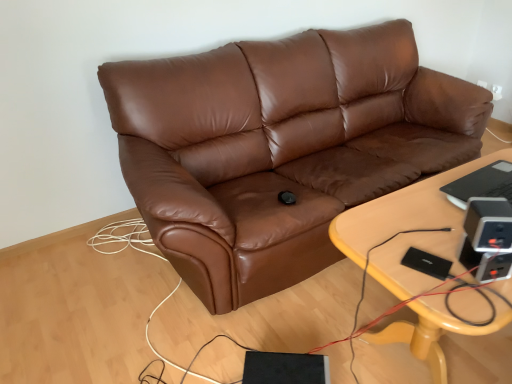
Describe the element at coordinates (407, 228) in the screenshot. I see `light wood/yellowishmaterial/texture table at center` at that location.

What are the coordinates of `light wood/yellowishmaterial/texture table at center` in the screenshot? It's located at (407, 228).

At what (x,y) coordinates should I click in order to perform the action: click on brown leather couch at center. Please return your answer as a coordinate pair (x, y). Looking at the image, I should click on (280, 148).

What do you see at coordinates (280, 148) in the screenshot?
I see `brown leather couch at center` at bounding box center [280, 148].

In order to click on light wood/yellowishmaterial/texture table at center in this screenshot , I will do `click(407, 228)`.

Considering the positions of objects brown leather couch at center and light wood/yellowishmaterial/texture table at center in the image provided, who is more to the right, brown leather couch at center or light wood/yellowishmaterial/texture table at center?

Positioned to the right is light wood/yellowishmaterial/texture table at center.

Considering their positions, is brown leather couch at center located in front of or behind light wood/yellowishmaterial/texture table at center?

brown leather couch at center is positioned farther from the viewer than light wood/yellowishmaterial/texture table at center.

Is point (477, 124) more distant than point (459, 224)?

That is True.

From the image's perspective, which is below, brown leather couch at center or light wood/yellowishmaterial/texture table at center?

light wood/yellowishmaterial/texture table at center appears lower in the image.

From a real-world perspective, is brown leather couch at center on light wood/yellowishmaterial/texture table at center?

Yes, from a real-world perspective, brown leather couch at center is over light wood/yellowishmaterial/texture table at center

Is brown leather couch at center wider than light wood/yellowishmaterial/texture table at center?

Indeed, brown leather couch at center has a greater width compared to light wood/yellowishmaterial/texture table at center.

Is brown leather couch at center taller than light wood/yellowishmaterial/texture table at center?

Yes, brown leather couch at center is taller than light wood/yellowishmaterial/texture table at center.

Does brown leather couch at center have a smaller size compared to light wood/yellowishmaterial/texture table at center?

Actually, brown leather couch at center might be larger than light wood/yellowishmaterial/texture table at center.

Does brown leather couch at center contain light wood/yellowishmaterial/texture table at center?

Definitely not — light wood/yellowishmaterial/texture table at center is not inside brown leather couch at center.

Is brown leather couch at center positioned far away from light wood/yellowishmaterial/texture table at center?

No.

Looking at this image, could you tell me if brown leather couch at center is turned towards light wood/yellowishmaterial/texture table at center?

Yes, brown leather couch at center is oriented towards light wood/yellowishmaterial/texture table at center.

How many degrees apart are the facing directions of brown leather couch at center and light wood/yellowishmaterial/texture table at center?

1.08 degrees separate the facing orientations of brown leather couch at center and light wood/yellowishmaterial/texture table at center.

You are a GUI agent. You are given a task and a screenshot of the screen. Output one action in this format:
    pyautogui.click(x=<x>, y=<y>)
    Task: Click on the table below the brown leather couch at center (from a real-world perspective)
    
    Given the screenshot: What is the action you would take?
    pyautogui.click(x=407, y=228)

Which object is positioned more to the left, light wood/yellowishmaterial/texture table at center or brown leather couch at center?

Positioned to the left is brown leather couch at center.

Which object is more forward, light wood/yellowishmaterial/texture table at center or brown leather couch at center?

light wood/yellowishmaterial/texture table at center is closer to the camera.

Is point (424, 310) less distant than point (253, 66)?

Yes, it is.

From the image's perspective, between light wood/yellowishmaterial/texture table at center and brown leather couch at center, who is located below?

light wood/yellowishmaterial/texture table at center is shown below in the image.

Based on the photo, from a real-world perspective, between light wood/yellowishmaterial/texture table at center and brown leather couch at center, who is vertically higher?

In real-world perspective, brown leather couch at center is above.

Which of these two, light wood/yellowishmaterial/texture table at center or brown leather couch at center, is wider?

Wider between the two is brown leather couch at center.

Who is shorter, light wood/yellowishmaterial/texture table at center or brown leather couch at center?

Standing shorter between the two is light wood/yellowishmaterial/texture table at center.

Between light wood/yellowishmaterial/texture table at center and brown leather couch at center, which one has smaller size?

With smaller size is light wood/yellowishmaterial/texture table at center.

In the scene shown: Is light wood/yellowishmaterial/texture table at center outside of brown leather couch at center?

Yes, light wood/yellowishmaterial/texture table at center is located beyond the bounds of brown leather couch at center.

Looking at this image, are light wood/yellowishmaterial/texture table at center and brown leather couch at center far apart?

No, light wood/yellowishmaterial/texture table at center is in close proximity to brown leather couch at center.

Is light wood/yellowishmaterial/texture table at center oriented towards brown leather couch at center?

No, light wood/yellowishmaterial/texture table at center is not aimed at brown leather couch at center.

How different are the orientations of light wood/yellowishmaterial/texture table at center and brown leather couch at center in degrees?

The facing directions of light wood/yellowishmaterial/texture table at center and brown leather couch at center are 1.08 degrees apart.

From the picture: Could you measure the distance between light wood/yellowishmaterial/texture table at center and brown leather couch at center?

A distance of 27.29 inches exists between light wood/yellowishmaterial/texture table at center and brown leather couch at center.

This screenshot has height=384, width=512. What are the coordinates of `studio couch lying above the light wood/yellowishmaterial/texture table at center (from the image's perspective)` in the screenshot? It's located at (280, 148).

The width and height of the screenshot is (512, 384). Find the location of `studio couch lying behind the light wood/yellowishmaterial/texture table at center`. studio couch lying behind the light wood/yellowishmaterial/texture table at center is located at coordinates (280, 148).

Identify the location of table lying below the brown leather couch at center (from the image's perspective). The width and height of the screenshot is (512, 384). (407, 228).